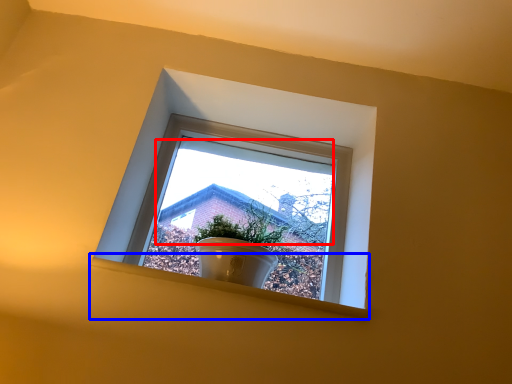
Question: Which object appears farthest to the camera in this image, morning light (highlighted by a red box) or window sill (highlighted by a blue box)?

Choices:
 (A) morning light
 (B) window sill

Answer: (B)